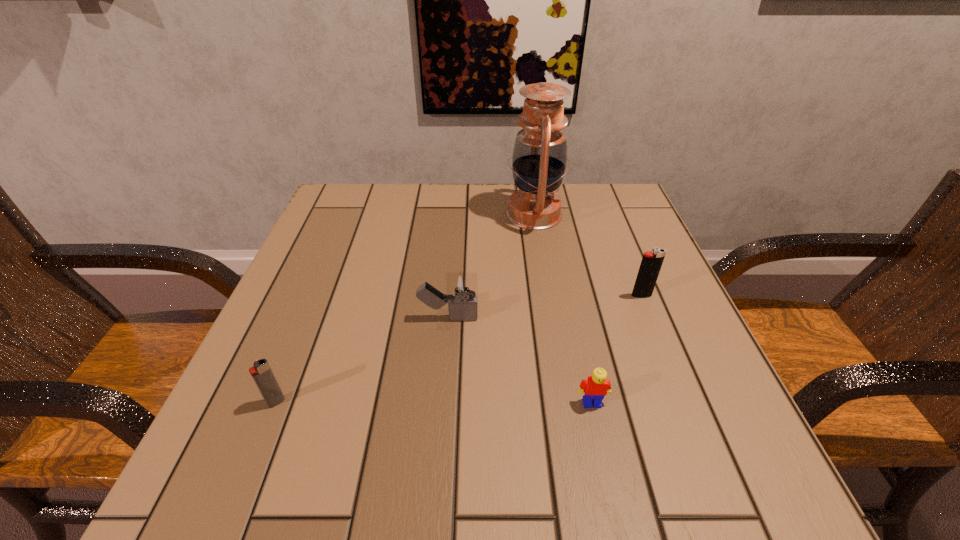
The height and width of the screenshot is (540, 960). What are the coordinates of `vacant space at the right edge of the desktop` in the screenshot? It's located at 590,265.

Locate an element on the screen. The height and width of the screenshot is (540, 960). free space at the far left corner of the desktop is located at coordinates tap(372, 229).

This screenshot has height=540, width=960. I want to click on vacant space at the near left corner of the desktop, so click(289, 505).

The height and width of the screenshot is (540, 960). Find the location of `blank area at the far right corner`. blank area at the far right corner is located at coordinates (625, 226).

Find the location of a particular element. free area in between the Lego and the oil lamp is located at coordinates (563, 309).

Where is `vacant area between the fourth object from right to left and the Lego`? The height and width of the screenshot is (540, 960). vacant area between the fourth object from right to left and the Lego is located at coordinates (520, 360).

Identify the location of unoccupied position between the second igniter from left to right and the farthest igniter. (545, 307).

Where is `vacant area that lies between the shortest object and the leftmost object`? vacant area that lies between the shortest object and the leftmost object is located at coordinates (434, 402).

Where is `vacant space in between the shortest igniter and the tallest object`? This screenshot has height=540, width=960. vacant space in between the shortest igniter and the tallest object is located at coordinates (405, 308).

What are the coordinates of `vacant area between the second igniter from left to right and the rightmost object` in the screenshot? It's located at (545, 307).